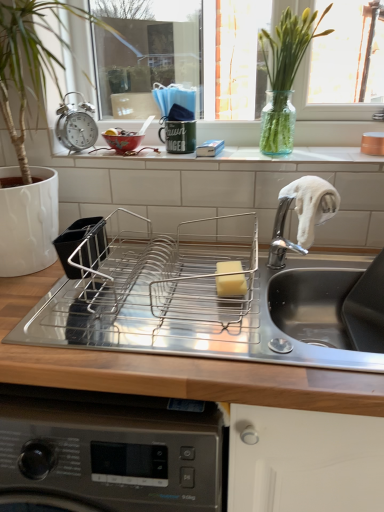
Question: From their relative heights in the image, would you say stainless steel sink at center is taller or shorter than metallic alarm clock at upper left?

Choices:
 (A) tall
 (B) short

Answer: (A)

Question: Relative to metallic alarm clock at upper left, is stainless steel sink at center in front or behind?

Choices:
 (A) behind
 (B) front

Answer: (B)

Question: Which object is positioned closest to the stainless steel dish rack at center?

Choices:
 (A) matte ceramic bowl at upper left
 (B) metallic alarm clock at upper left
 (C) yellow sponge at center
 (D) white ceramic window sill at center
 (E) green glass vase at upper center

Answer: (C)

Question: Considering the real-world distances, which object is closest to the white ceramic window sill at center?

Choices:
 (A) yellow sponge at center
 (B) matte ceramic bowl at upper left
 (C) metallic alarm clock at upper left
 (D) green glass vase at upper center
 (E) stainless steel dish rack at center

Answer: (D)